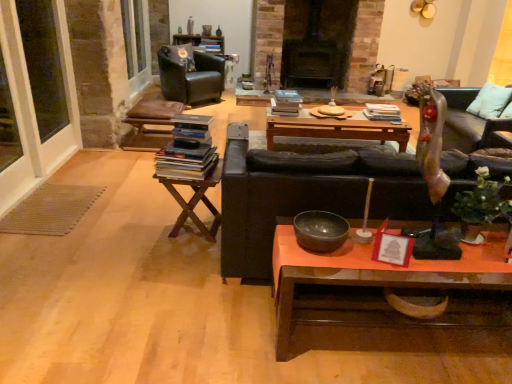
The width and height of the screenshot is (512, 384). What are the coordinates of `free point above matte black bowl at center (from a real-world perspective)` in the screenshot? It's located at tap(325, 226).